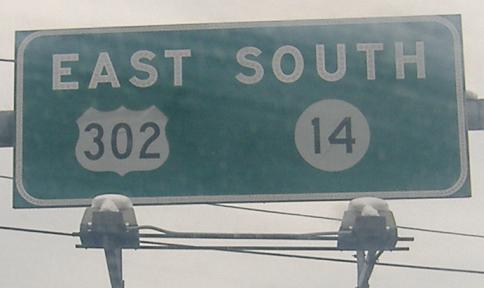
Where is `square corners`? square corners is located at coordinates (468, 194), (458, 13), (15, 31), (12, 206).